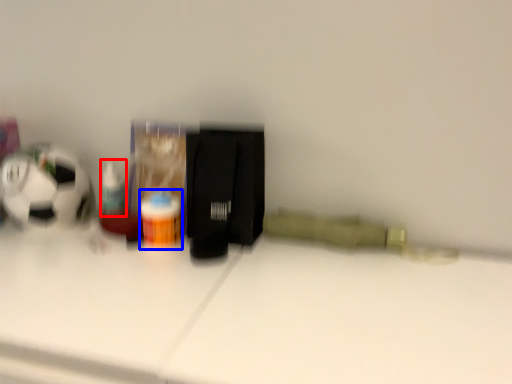
Question: Which object appears farthest to the camera in this image, toiletry (highlighted by a red box) or bottle (highlighted by a blue box)?

Choices:
 (A) toiletry
 (B) bottle

Answer: (A)